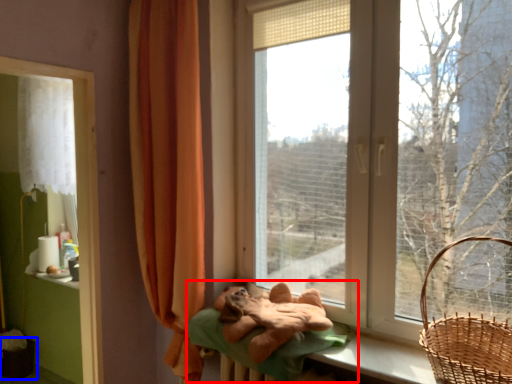
Question: Which point is closer to the camera, bed (highlighted by a red box) or basket container (highlighted by a blue box)?

Choices:
 (A) bed
 (B) basket container

Answer: (A)